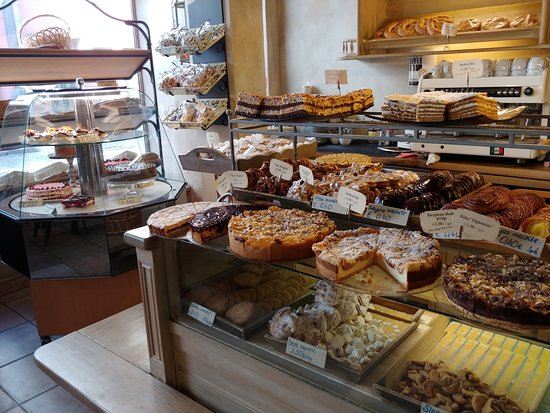
Find the location of a particular element. white tile is located at coordinates (15, 381).